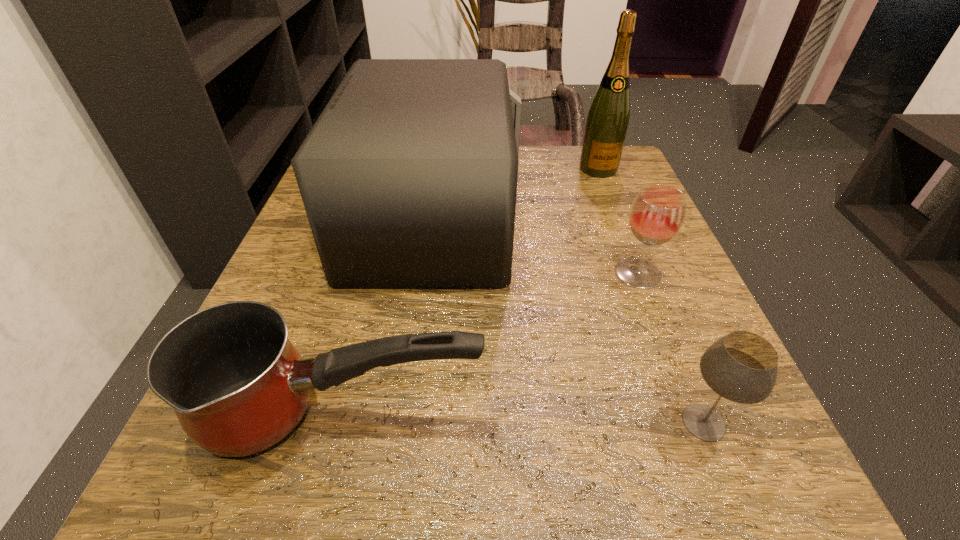
Where is `wine bottle`? Image resolution: width=960 pixels, height=540 pixels. wine bottle is located at coordinates (607, 122).

The image size is (960, 540). Identify the location of the second tallest object. (408, 177).

At what (x,y) coordinates should I click in order to perform the action: click on the farther wineglass. Please return your answer as a coordinate pair (x, y). Looking at the image, I should click on (656, 216).

The height and width of the screenshot is (540, 960). Find the location of `saucepan`. saucepan is located at coordinates (237, 385).

Locate an element on the screen. The width and height of the screenshot is (960, 540). the nearer wineglass is located at coordinates (742, 367).

The height and width of the screenshot is (540, 960). I want to click on vacant area situated 0.080m on the front-facing side of the wine bottle, so click(x=610, y=198).

This screenshot has height=540, width=960. What are the coordinates of `free space located 0.110m on the front-facing side of the second tallest object` in the screenshot? It's located at (574, 218).

At what (x,y) coordinates should I click in order to perform the action: click on vacant space situated 0.290m on the left of the farther wineglass. Please return your answer as a coordinate pair (x, y). The width and height of the screenshot is (960, 540). Looking at the image, I should click on (445, 273).

At what (x,y) coordinates should I click in order to perform the action: click on free space located on the handle side of the saucepan. Please return your answer as a coordinate pair (x, y). The width and height of the screenshot is (960, 540). Looking at the image, I should click on (696, 415).

Identify the location of free point located on the left of the nearer wineglass. (499, 422).